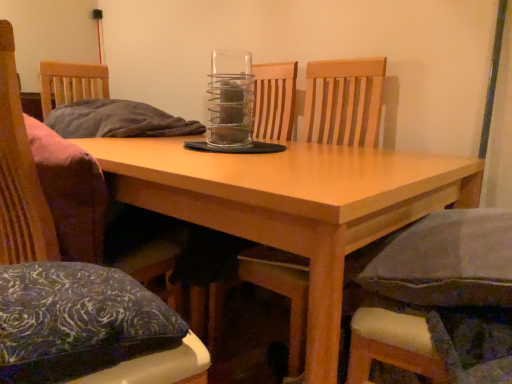
Question: Is fabric cushioned chair at lower right, positioned as the 1th chair in right-to-left order, positioned behind light wood table at center?

Choices:
 (A) yes
 (B) no

Answer: (A)

Question: Considering the relative sizes of fabric cushioned chair at lower right, marked as the third chair in a left-to-right arrangement, and light wood table at center in the image provided, is fabric cushioned chair at lower right, marked as the third chair in a left-to-right arrangement, taller than light wood table at center?

Choices:
 (A) yes
 (B) no

Answer: (B)

Question: Is the position of fabric cushioned chair at lower right, marked as the third chair in a left-to-right arrangement, less distant than that of light wood table at center?

Choices:
 (A) no
 (B) yes

Answer: (A)

Question: From the image's perspective, is fabric cushioned chair at lower right, positioned as the 1th chair in right-to-left order, located beneath light wood table at center?

Choices:
 (A) no
 (B) yes

Answer: (A)

Question: Is fabric cushioned chair at lower right, positioned as the 1th chair in right-to-left order, positioned with its back to light wood table at center?

Choices:
 (A) no
 (B) yes

Answer: (B)

Question: Would you say blue patterned pillow at lower left is to the left or to the right of wooden chair at center, which is the second chair from left to right, in the picture?

Choices:
 (A) right
 (B) left

Answer: (B)

Question: Does point coord(73,347) appear closer or farther from the camera than point coord(300,304)?

Choices:
 (A) farther
 (B) closer

Answer: (B)

Question: From the image's perspective, is blue patterned pillow at lower left above or below wooden chair at center, which is the second chair in right-to-left order?

Choices:
 (A) below
 (B) above

Answer: (A)

Question: Is blue patterned pillow at lower left in front of or behind wooden chair at center, which is the second chair from left to right, in the image?

Choices:
 (A) behind
 (B) front

Answer: (B)

Question: Considering the positions of wooden chair at left, marked as the third chair in a right-to-left arrangement, and fabric cushioned chair at lower right, marked as the third chair in a left-to-right arrangement, in the image, is wooden chair at left, marked as the third chair in a right-to-left arrangement, taller or shorter than fabric cushioned chair at lower right, marked as the third chair in a left-to-right arrangement,?

Choices:
 (A) short
 (B) tall

Answer: (B)

Question: From the image's perspective, is wooden chair at left, marked as the third chair in a right-to-left arrangement, positioned above or below fabric cushioned chair at lower right, marked as the third chair in a left-to-right arrangement?

Choices:
 (A) above
 (B) below

Answer: (A)

Question: From a real-world perspective, is wooden chair at left, which ranks as the 1th chair in left-to-right order, above or below fabric cushioned chair at lower right, marked as the third chair in a left-to-right arrangement?

Choices:
 (A) above
 (B) below

Answer: (A)

Question: Looking at their shapes, would you say wooden chair at left, which ranks as the 1th chair in left-to-right order, is wider or thinner than fabric cushioned chair at lower right, positioned as the 1th chair in right-to-left order?

Choices:
 (A) thin
 (B) wide

Answer: (A)

Question: Does point (82, 274) appear closer or farther from the camera than point (215, 296)?

Choices:
 (A) farther
 (B) closer

Answer: (B)

Question: From a real-world perspective, relative to matte black pillow at center, is blue patterned pillow at lower left vertically above or below?

Choices:
 (A) above
 (B) below

Answer: (B)